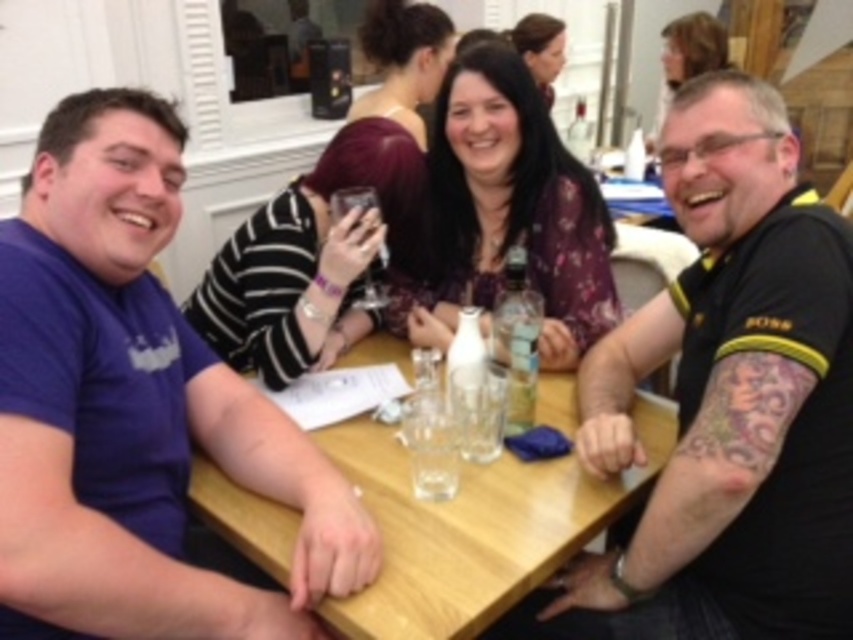
Between point (708, 396) and point (635, 394), which one is positioned behind?

The point (635, 394) is behind.

Does point (811, 230) come closer to viewer compared to point (643, 474)?

Yes, it is.

Is point (663, 589) less distant than point (651, 435)?

Yes, point (663, 589) is closer to viewer.

This screenshot has width=853, height=640. What are the coordinates of `black jersey at right` in the screenshot? It's located at (735, 385).

At what (x,y) coordinates should I click in order to perform the action: click on black jersey at right. Please return your answer as a coordinate pair (x, y). This screenshot has height=640, width=853. Looking at the image, I should click on (735, 385).

Between black jersey at right and floral-patterned blouse at center, which one has less height?

floral-patterned blouse at center

I want to click on black jersey at right, so click(735, 385).

Where is `black jersey at right`? black jersey at right is located at coordinates (735, 385).

Who is shorter, floral-patterned blouse at center or transparent glass at table center?

transparent glass at table center

Based on the photo, is floral-patterned blouse at center wider than transparent glass at table center?

Correct, the width of floral-patterned blouse at center exceeds that of transparent glass at table center.

Which is in front, point (514, 122) or point (444, 422)?

Point (444, 422) is more forward.

Where is `floral-patterned blouse at center`? This screenshot has height=640, width=853. floral-patterned blouse at center is located at coordinates (508, 212).